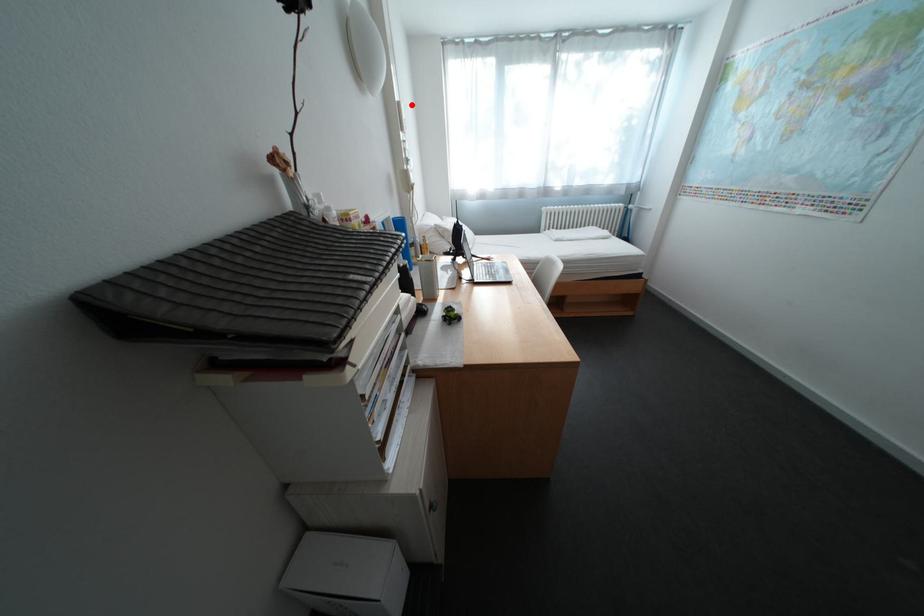
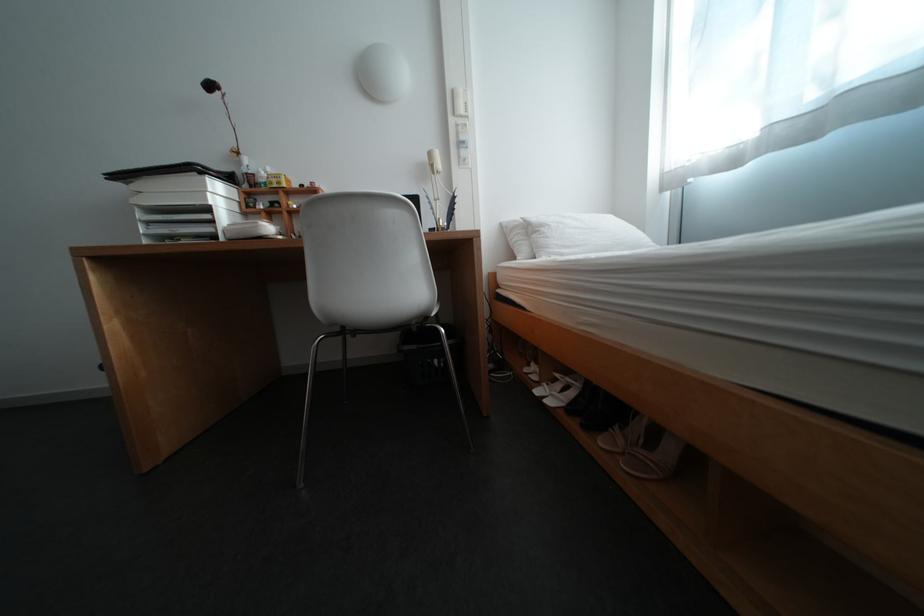
In the second image, find the point that corresponds to the highlighted location in the first image.

(466, 92)